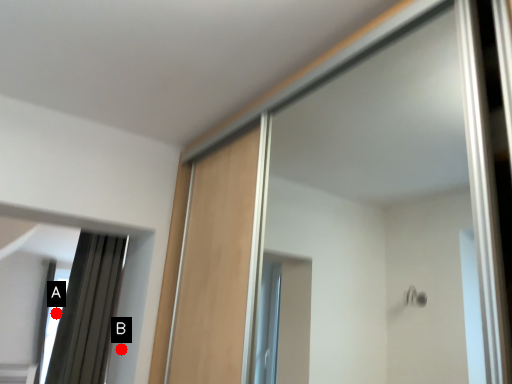
Question: Two points are circled on the image, labeled by A and B beside each circle. Which of the following is the farthest from the observer?

Choices:
 (A) A is further
 (B) B is further

Answer: (A)